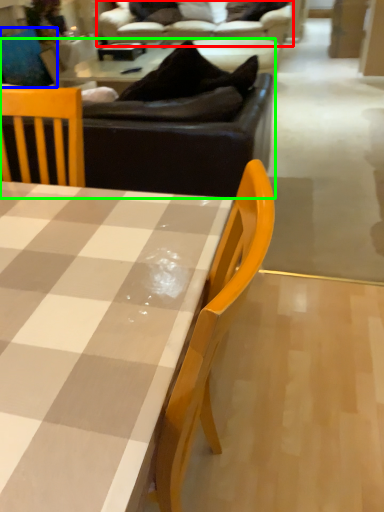
Question: Estimate the real-world distances between objects in this image. Which object is closer to studio couch (highlighted by a red box), swivel chair (highlighted by a blue box) or studio couch (highlighted by a green box)?

Choices:
 (A) swivel chair
 (B) studio couch

Answer: (A)